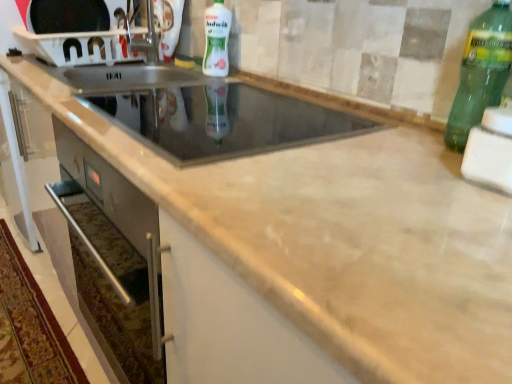
Question: Is white foam sponge at right, acting as the first appliance starting from the right, further to camera compared to white plastic microwave at upper left, arranged as the third appliance when ordered from the bottom?

Choices:
 (A) no
 (B) yes

Answer: (A)

Question: Does white foam sponge at right, the 3th appliance from the top, have a larger size compared to white plastic microwave at upper left, marked as the 1th appliance in a back-to-front arrangement?

Choices:
 (A) yes
 (B) no

Answer: (B)

Question: Is white foam sponge at right, which appears as the third appliance when viewed from the back, wider than white plastic microwave at upper left, marked as the 1th appliance in a back-to-front arrangement?

Choices:
 (A) yes
 (B) no

Answer: (A)

Question: Considering the relative sizes of white foam sponge at right, marked as the 1th appliance in a front-to-back arrangement, and white plastic microwave at upper left, arranged as the third appliance when ordered from the bottom, in the image provided, is white foam sponge at right, marked as the 1th appliance in a front-to-back arrangement, smaller than white plastic microwave at upper left, arranged as the third appliance when ordered from the bottom,?

Choices:
 (A) no
 (B) yes

Answer: (B)

Question: Is white foam sponge at right, the third appliance from the left, with white plastic microwave at upper left, marked as the 1th appliance in a back-to-front arrangement?

Choices:
 (A) yes
 (B) no

Answer: (B)

Question: In terms of size, does white glossy bottle at upper center, which appears as the 2th bottle when ordered from the bottom, appear bigger or smaller than glass stovetop at center, acting as the 2th appliance starting from the back?

Choices:
 (A) small
 (B) big

Answer: (A)

Question: From the image's perspective, is white glossy bottle at upper center, positioned as the second bottle in right-to-left order, positioned above or below glass stovetop at center, the second appliance positioned from the top?

Choices:
 (A) below
 (B) above

Answer: (B)

Question: Visually, is white glossy bottle at upper center, which is the 1th bottle in top-to-bottom order, positioned to the left or to the right of glass stovetop at center, which is the second appliance in bottom-to-top order?

Choices:
 (A) left
 (B) right

Answer: (A)

Question: In the image, is white glossy bottle at upper center, the first bottle viewed from the left, positioned in front of or behind glass stovetop at center, the second appliance from the front?

Choices:
 (A) behind
 (B) front

Answer: (A)

Question: Considering the positions of point (292, 114) and point (463, 155), is point (292, 114) closer or farther from the camera than point (463, 155)?

Choices:
 (A) closer
 (B) farther

Answer: (B)

Question: From a real-world perspective, is glass stovetop at center, which is counted as the 2th appliance, starting from the left, positioned above or below white foam sponge at right, the third appliance from the left?

Choices:
 (A) below
 (B) above

Answer: (A)

Question: Choose the correct answer: Is glass stovetop at center, the second appliance positioned from the top, inside white foam sponge at right, the third appliance from the left, or outside it?

Choices:
 (A) outside
 (B) inside

Answer: (A)

Question: Is glass stovetop at center, which appears as the second appliance when viewed from the right, wider or thinner than white foam sponge at right, marked as the 1th appliance in a front-to-back arrangement?

Choices:
 (A) thin
 (B) wide

Answer: (B)

Question: Looking at the image, does white foam sponge at right, acting as the first appliance starting from the right, seem bigger or smaller compared to white glossy bottle at upper center, arranged as the 2th bottle when viewed from the front?

Choices:
 (A) big
 (B) small

Answer: (B)

Question: Considering the positions of white foam sponge at right, the third appliance from the left, and white glossy bottle at upper center, which is the 1th bottle in top-to-bottom order, in the image, is white foam sponge at right, the third appliance from the left, taller or shorter than white glossy bottle at upper center, which is the 1th bottle in top-to-bottom order,?

Choices:
 (A) tall
 (B) short

Answer: (B)